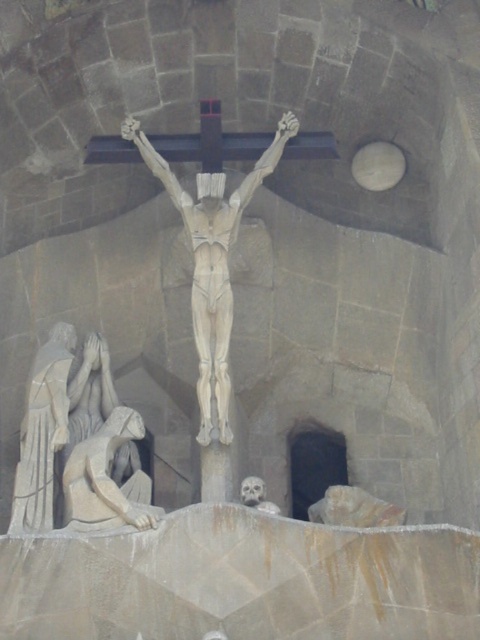
Question: Observing the image, what is the correct spatial positioning of smooth stone statue at lower left in reference to smooth gray skull at lower center?

Choices:
 (A) right
 (B) left

Answer: (B)

Question: Which of the following is the farthest from the observer?

Choices:
 (A) smooth stone statue at lower left
 (B) smooth gray skull at lower center

Answer: (B)

Question: Is smooth stone crucifix at center below smooth stone statue at lower left?

Choices:
 (A) yes
 (B) no

Answer: (B)

Question: Is smooth stone crucifix at center to the right of smooth gray skull at lower center from the viewer's perspective?

Choices:
 (A) yes
 (B) no

Answer: (B)

Question: Which of the following is the closest to the observer?

Choices:
 (A) smooth gray skull at lower center
 (B) smooth stone crucifix at center

Answer: (A)

Question: Which object is closer to the camera taking this photo?

Choices:
 (A) smooth stone crucifix at center
 (B) smooth gray skull at lower center

Answer: (B)